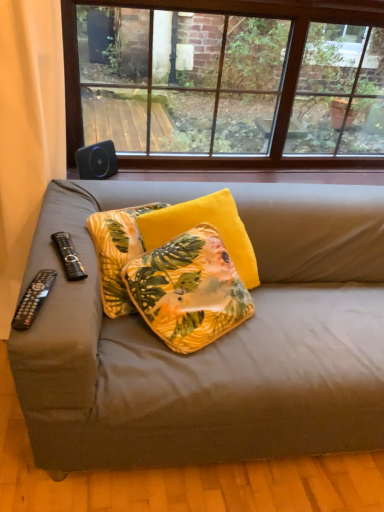
The height and width of the screenshot is (512, 384). What are the coordinates of `vacant area that lies between black plastic remote at lower left, marked as the second remote control in a back-to-front arrangement, and black plastic remote at left, the 1th remote control from the top` in the screenshot? It's located at (57, 280).